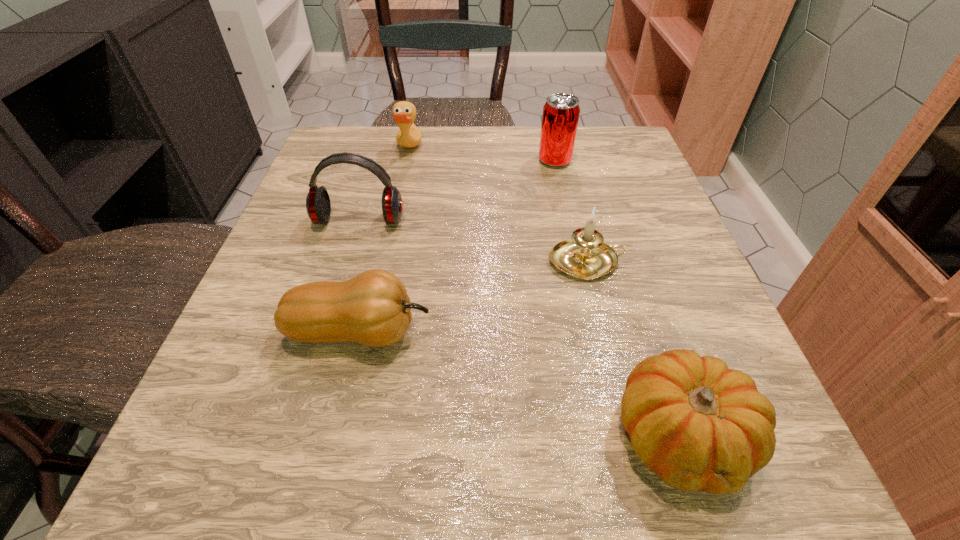
Where is `gourd that is positioned at the right edge`? gourd that is positioned at the right edge is located at coordinates pos(700,426).

The image size is (960, 540). What are the coordinates of `object that is at the far right corner` in the screenshot? It's located at tap(561, 112).

Identify the location of object located in the near right corner section of the desktop. This screenshot has height=540, width=960. (700, 426).

Identify the location of blank space at the far edge. The image size is (960, 540). (452, 127).

Where is `vacant point at the near edge`? vacant point at the near edge is located at coordinates (363, 468).

Where is `vacant space at the left edge of the desktop`? The height and width of the screenshot is (540, 960). vacant space at the left edge of the desktop is located at coordinates (276, 279).

At what (x,y) coordinates should I click in order to perform the action: click on vacant region at the right edge of the desktop. Please return your answer as a coordinate pair (x, y). The image size is (960, 540). Looking at the image, I should click on (673, 302).

At what (x,y) coordinates should I click in order to perform the action: click on blank space at the near left corner of the desktop. Please return your answer as a coordinate pair (x, y). The image size is (960, 540). Looking at the image, I should click on (267, 463).

Find the location of `vacant space that is in between the soda can and the duck`. vacant space that is in between the soda can and the duck is located at coordinates (482, 156).

Find the location of a particular element. The width and height of the screenshot is (960, 540). vacant region between the candle holder and the fourth nearest object is located at coordinates (473, 241).